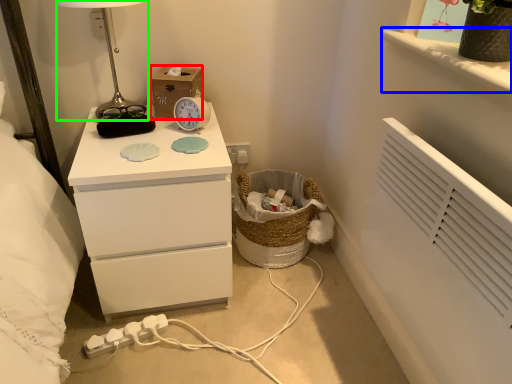
Question: Estimate the real-world distances between objects in this image. Which object is farther from cardboard box (highlighted by a red box), window sill (highlighted by a blue box) or table lamp (highlighted by a green box)?

Choices:
 (A) window sill
 (B) table lamp

Answer: (A)